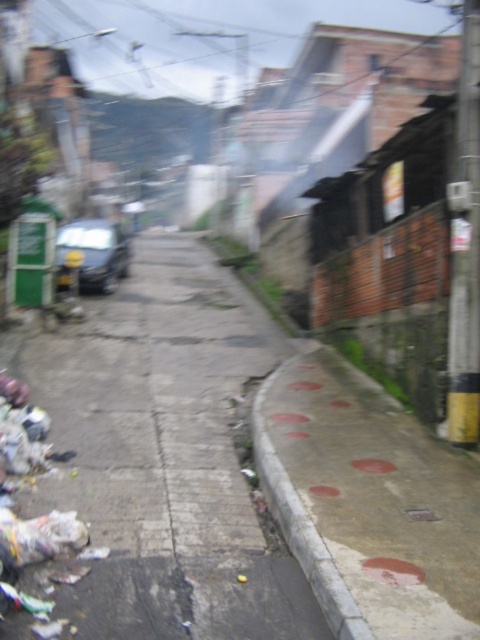
You are a delivery person trying to navigate a narrow sidewalk in an urban area. You see the concrete sidewalk at center and the concrete curb at lower right. Which one is positioned higher from the ground level?

The concrete sidewalk at center is located above the concrete curb at lower right, so it is positioned higher from the ground level.

You are a pedestrian walking on the sidewalk in the image. You see a white plastic bag at lower left and a concrete curb at lower right. Which object is closer to your feet?

The white plastic bag at lower left is closer to your feet since it is positioned above the concrete curb at lower right, meaning it is nearer to the pedestrian on the sidewalk.